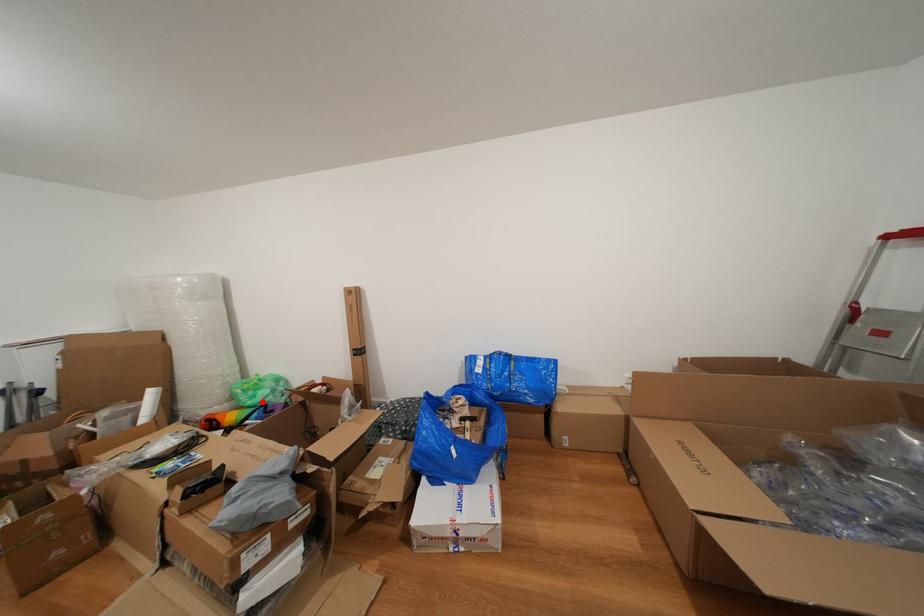
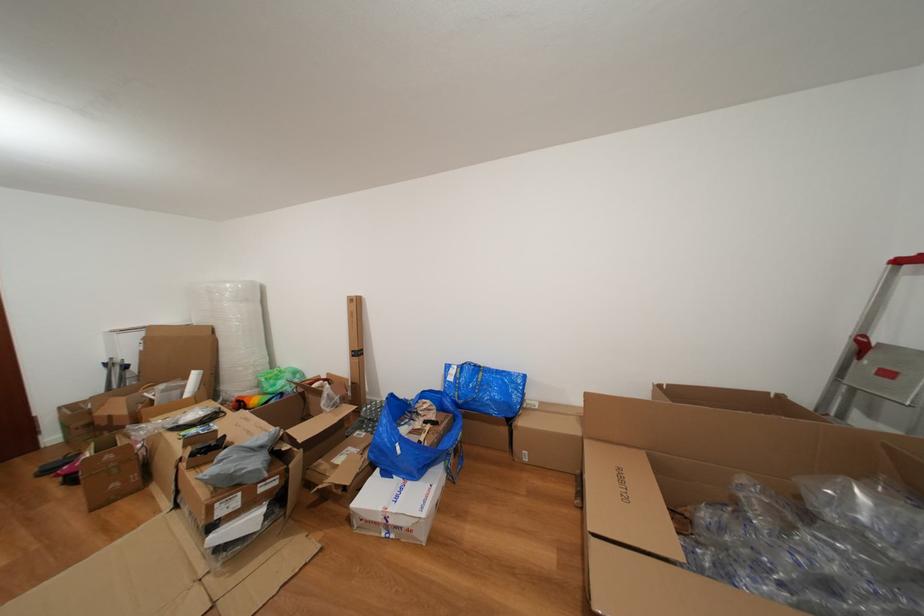
Question: A red point is marked in image1. In image2, is the corresponding 3D point closer to the camera or farther? Reply with the corresponding letter.

Choices:
 (A) The corresponding 3D point is closer.
 (B) The corresponding 3D point is farther.

Answer: (B)